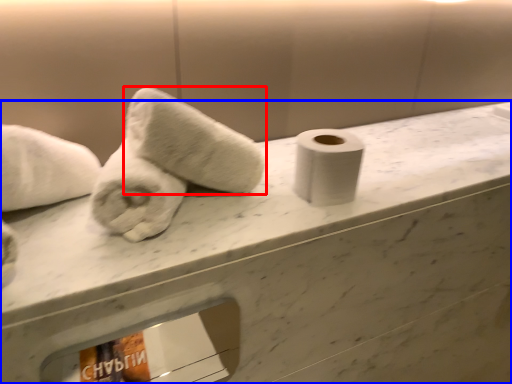
Question: Which object appears farthest to the camera in this image, towel (highlighted by a red box) or counter (highlighted by a blue box)?

Choices:
 (A) towel
 (B) counter

Answer: (A)